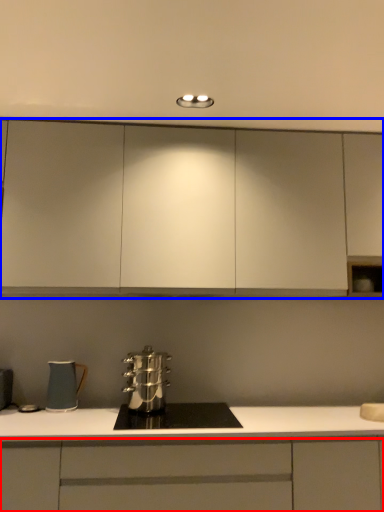
Question: Among these objects, which one is farthest to the camera, cabinetry (highlighted by a red box) or cabinetry (highlighted by a blue box)?

Choices:
 (A) cabinetry
 (B) cabinetry

Answer: (B)